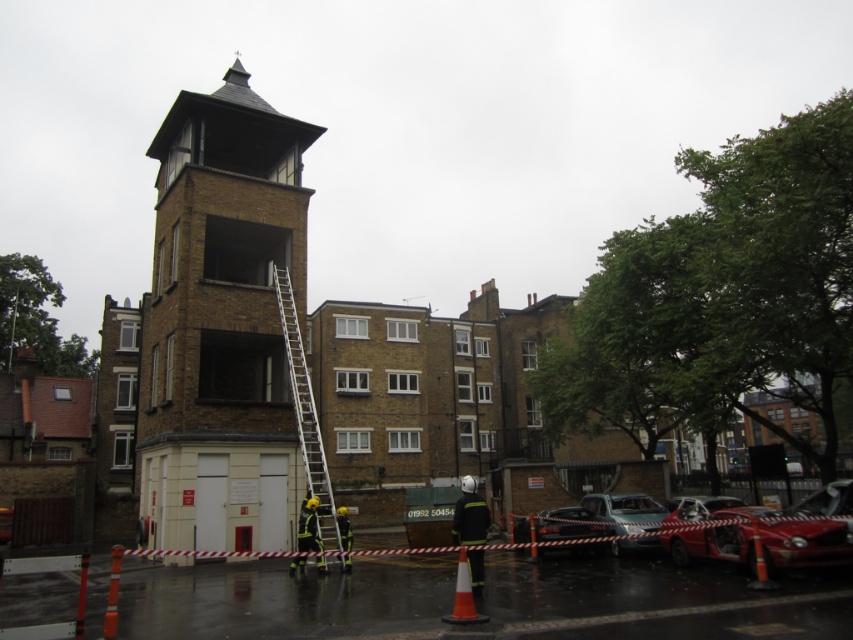
Can you confirm if damaged red car at lower right is positioned above metallic silver ladder at center?

Incorrect, damaged red car at lower right is not positioned above metallic silver ladder at center.

Is point (767, 545) more distant than point (283, 336)?

No, (767, 545) is closer to viewer.

Image resolution: width=853 pixels, height=640 pixels. Identify the location of damaged red car at lower right. (758, 532).

Consider the image. Who is lower down, brown brick bell tower at center or damaged red car at lower right?

Positioned lower is damaged red car at lower right.

Between brown brick bell tower at center and damaged red car at lower right, which one appears on the left side from the viewer's perspective?

brown brick bell tower at center is more to the left.

Which is behind, point (202, 193) or point (795, 560)?

Point (202, 193)

Find the location of a particular element. brown brick bell tower at center is located at coordinates (x=222, y=324).

Consider the image. Is the position of brown brick bell tower at center less distant than that of metallic silver ladder at center?

That is False.

Is brown brick bell tower at center below metallic silver ladder at center?

Actually, brown brick bell tower at center is above metallic silver ladder at center.

Is point (186, 518) behind point (318, 460)?

No.

You are a GUI agent. You are given a task and a screenshot of the screen. Output one action in this format:
    pyautogui.click(x=<x>, y=<y>)
    Task: Click on the brown brick bell tower at center
    Image resolution: width=853 pixels, height=640 pixels.
    Given the screenshot: What is the action you would take?
    pyautogui.click(x=222, y=324)